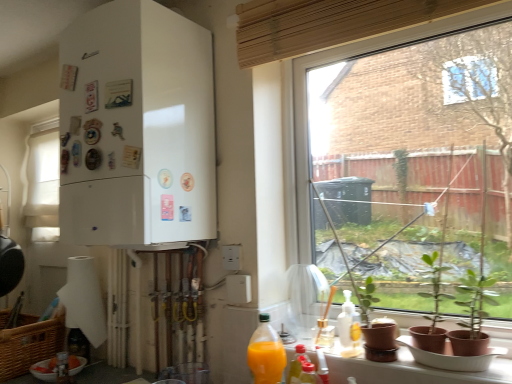
Question: From a real-world perspective, is transparent glass window at center, the 2th window from the left, below white matte refrigerator at left?

Choices:
 (A) yes
 (B) no

Answer: (A)

Question: Is white matte refrigerator at left a part of transparent glass window at center, the 2th window in the back-to-front sequence?

Choices:
 (A) yes
 (B) no

Answer: (B)

Question: Are transparent glass window at center, which is counted as the first window, starting from the right, and white matte refrigerator at left far apart?

Choices:
 (A) no
 (B) yes

Answer: (A)

Question: Does transparent glass window at center, the 2th window in the back-to-front sequence, have a greater height compared to white matte refrigerator at left?

Choices:
 (A) no
 (B) yes

Answer: (B)

Question: From the image's perspective, would you say transparent glass window at center, the 2th window in the back-to-front sequence, is positioned over white matte refrigerator at left?

Choices:
 (A) no
 (B) yes

Answer: (A)

Question: Does point (57, 365) appear closer or farther from the camera than point (40, 370)?

Choices:
 (A) closer
 (B) farther

Answer: (A)

Question: From the image's perspective, is translucent plastic bottle at lower left, the first bottle from the back, positioned above or below white matte bowl at lower left?

Choices:
 (A) below
 (B) above

Answer: (B)

Question: Considering the positions of translucent plastic bottle at lower left, the 1th bottle positioned from the left, and white matte bowl at lower left in the image, is translucent plastic bottle at lower left, the 1th bottle positioned from the left, wider or thinner than white matte bowl at lower left?

Choices:
 (A) thin
 (B) wide

Answer: (A)

Question: In terms of size, does translucent plastic bottle at lower left, which is counted as the 4th bottle, starting from the front, appear bigger or smaller than white matte bowl at lower left?

Choices:
 (A) big
 (B) small

Answer: (B)

Question: Based on their sizes in the image, would you say translucent plastic bottle at lower left, the fourth bottle positioned from the right, is bigger or smaller than white fabric curtain at left, the 2th window when ordered from right to left?

Choices:
 (A) small
 (B) big

Answer: (A)

Question: From a real-world perspective, relative to white fabric curtain at left, the 2th window when ordered from right to left, is translucent plastic bottle at lower left, the 1th bottle positioned from the left, vertically above or below?

Choices:
 (A) above
 (B) below

Answer: (B)

Question: Which is correct: translucent plastic bottle at lower left, the 1th bottle positioned from the left, is inside white fabric curtain at left, the 2th window when ordered from right to left, or outside of it?

Choices:
 (A) inside
 (B) outside

Answer: (B)

Question: Looking at their shapes, would you say translucent plastic bottle at lower left, the 1th bottle positioned from the left, is wider or thinner than white fabric curtain at left, which is the 2th window in front-to-back order?

Choices:
 (A) thin
 (B) wide

Answer: (A)

Question: From the image's perspective, is transparent glass window at center, the 2th window in the back-to-front sequence, located above or below white fabric curtain at left, which ranks as the first window in back-to-front order?

Choices:
 (A) above
 (B) below

Answer: (A)

Question: Is transparent glass window at center, which is counted as the 1th window, starting from the front, bigger or smaller than white fabric curtain at left, the first window from the left?

Choices:
 (A) big
 (B) small

Answer: (A)